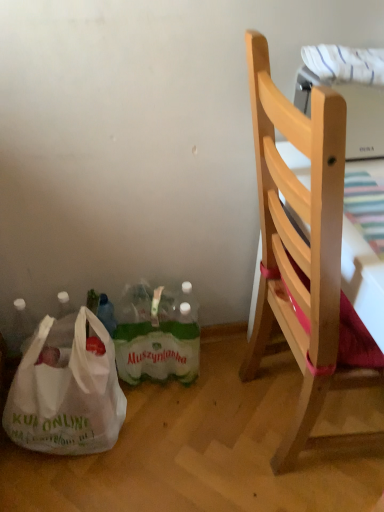
I want to click on free space in front of white plastic bag at lower left, so click(x=64, y=483).